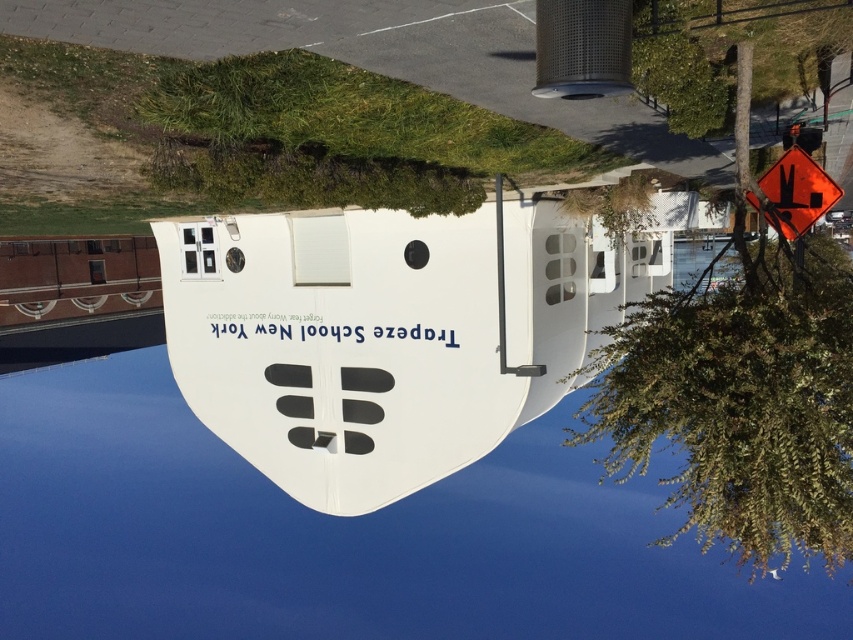
Question: Is blue glossy water at center closer to the viewer compared to orange reflective diamond at upper right?

Choices:
 (A) yes
 (B) no

Answer: (A)

Question: Which object is the farthest from the white matte boat at center?

Choices:
 (A) orange reflective diamond at upper right
 (B) blue glossy water at center

Answer: (B)

Question: Which is farther from the white matte boat at center?

Choices:
 (A) orange reflective diamond at upper right
 (B) blue glossy water at center

Answer: (B)

Question: Which object is the closest to the white matte boat at center?

Choices:
 (A) orange reflective diamond at upper right
 (B) blue glossy water at center

Answer: (A)

Question: Does blue glossy water at center appear over orange reflective diamond at upper right?

Choices:
 (A) yes
 (B) no

Answer: (B)

Question: Does blue glossy water at center have a smaller size compared to orange reflective diamond at upper right?

Choices:
 (A) no
 (B) yes

Answer: (A)